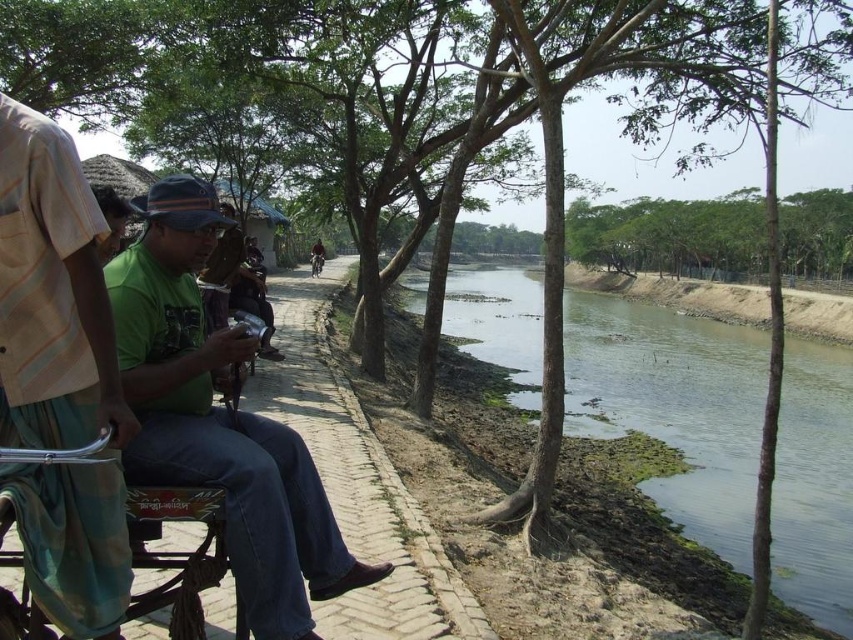
Who is higher up, green matte shirt at center or dark brown leather jacket at center?

dark brown leather jacket at center is above.

Does green matte shirt at center have a lesser height compared to dark brown leather jacket at center?

Indeed, green matte shirt at center has a lesser height compared to dark brown leather jacket at center.

Which is in front, point (297, 509) or point (318, 260)?

Positioned in front is point (297, 509).

The width and height of the screenshot is (853, 640). I want to click on green matte shirt at center, so click(x=219, y=419).

Can you confirm if light brown fabric shirt at left is positioned below dark brown leather jacket at center?

Indeed, light brown fabric shirt at left is positioned under dark brown leather jacket at center.

Can you confirm if light brown fabric shirt at left is positioned to the left of dark brown leather jacket at center?

No, light brown fabric shirt at left is not to the left of dark brown leather jacket at center.

Which is behind, point (102, 586) or point (317, 256)?

The point (317, 256) is more distant.

The width and height of the screenshot is (853, 640). What are the coordinates of `light brown fabric shirt at left` in the screenshot? It's located at (51, 292).

Is point (607, 424) farther from viewer compared to point (77, 348)?

Yes, point (607, 424) is farther from viewer.

Locate an element on the screen. green algae-covered water at center is located at coordinates (672, 404).